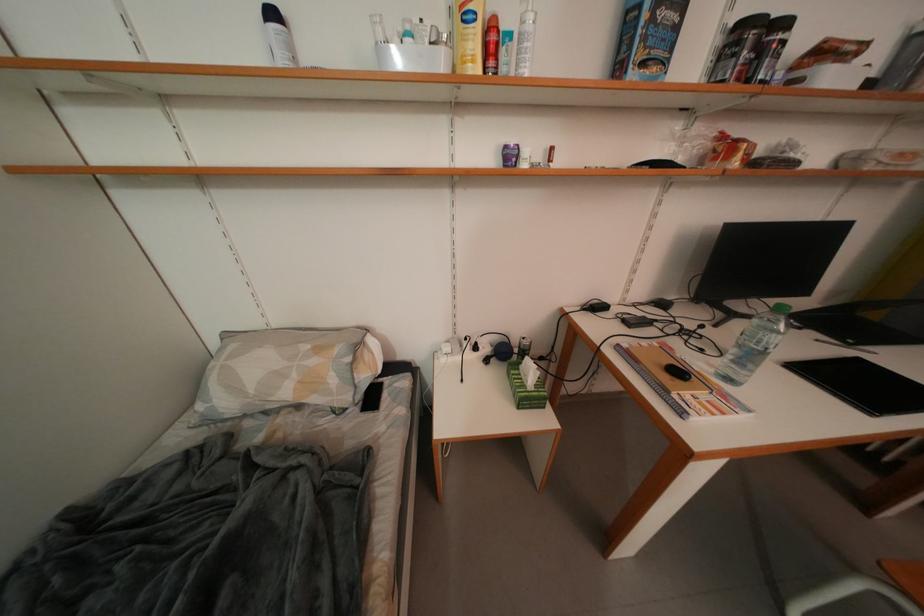
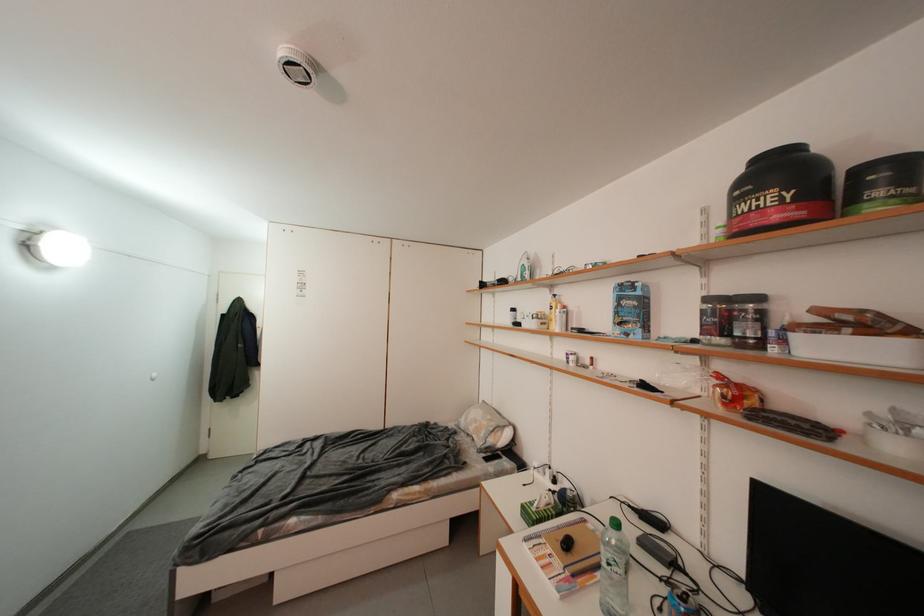
Locate, in the second image, the point that corresponds to [794,29] in the first image.

(766, 301)